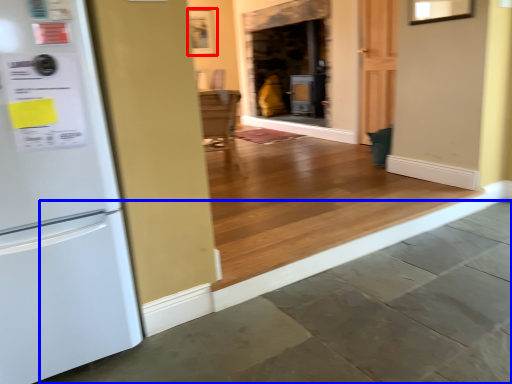
Question: Which of the following is the farthest to the observer, picture frame (highlighted by a red box) or concrete (highlighted by a blue box)?

Choices:
 (A) picture frame
 (B) concrete

Answer: (A)